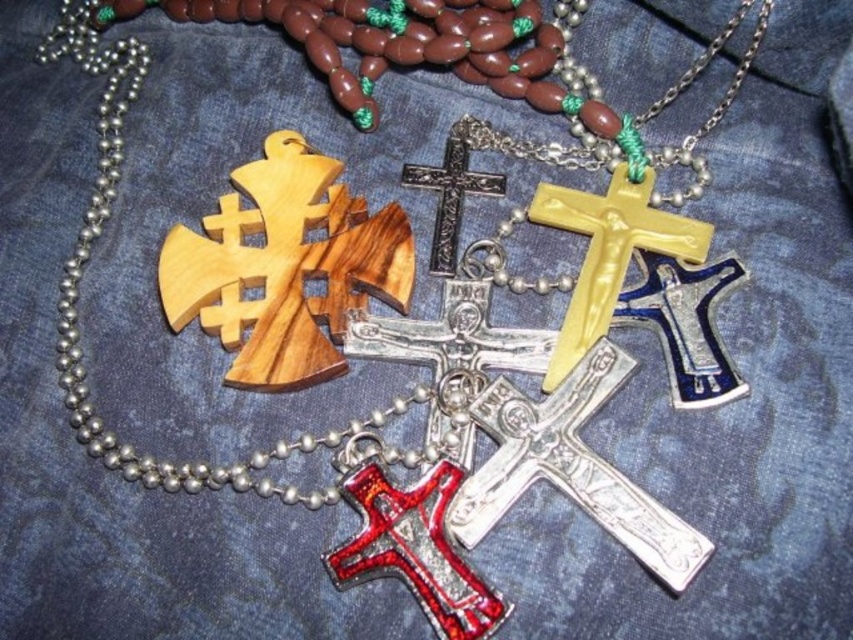
Question: Which point is closer to the camera?

Choices:
 (A) silver metallic cross at center
 (B) yellow glossy crucifix at center
 (C) shiny red cross at center
 (D) wooden cross at center

Answer: (A)

Question: In this image, where is wooden cross at center located relative to shiny red cross at center?

Choices:
 (A) above
 (B) below

Answer: (A)

Question: Which point is farther to the camera?

Choices:
 (A) (285, 240)
 (B) (398, 563)
 (C) (456, 262)
 (D) (613, 381)

Answer: (C)

Question: Does shiny red cross at center appear under yellow glossy crucifix at center?

Choices:
 (A) yes
 (B) no

Answer: (A)

Question: Which object is the farthest from the wooden cross at center?

Choices:
 (A) metallic silver cross at center
 (B) shiny red cross at center
 (C) yellow glossy crucifix at center

Answer: (C)

Question: Does wooden cross at center come in front of yellow glossy crucifix at center?

Choices:
 (A) no
 (B) yes

Answer: (A)